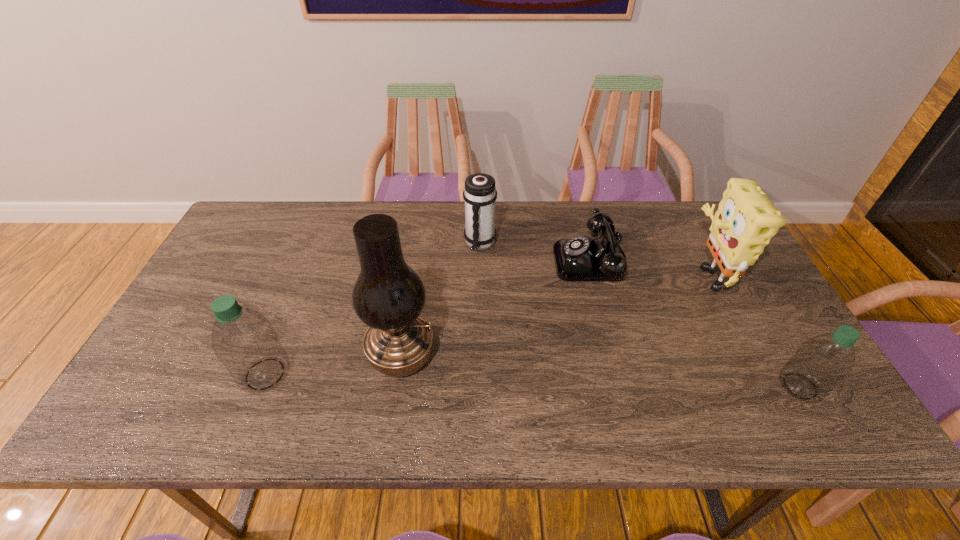
Find the location of a particular element. This screenshot has width=960, height=540. vacant region at the right edge is located at coordinates (725, 330).

Find the location of a particular element. The image size is (960, 540). vacant area at the far left corner is located at coordinates (252, 207).

In the image, there is a desktop. Where is `vacant area at the near left corner`? This screenshot has height=540, width=960. vacant area at the near left corner is located at coordinates (179, 382).

The image size is (960, 540). What are the coordinates of `free area in between the telephone and the thermos bottle` in the screenshot? It's located at (536, 252).

This screenshot has width=960, height=540. I want to click on free space between the third object from right to left and the fifth object from right to left, so click(496, 308).

Where is `free spot between the tallest object and the sponge`? This screenshot has width=960, height=540. free spot between the tallest object and the sponge is located at coordinates (553, 314).

Identify the location of free spot between the right water bottle and the telephone. This screenshot has width=960, height=540. (696, 323).

You are a GUI agent. You are given a task and a screenshot of the screen. Output one action in this format:
    pyautogui.click(x=<x>, y=<y>)
    Task: Click on the blank region between the thermos bottle and the shorter water bottle
    The width and height of the screenshot is (960, 540).
    Given the screenshot: What is the action you would take?
    pyautogui.click(x=640, y=315)

Identify the location of unoccupied position between the oil lamp and the thermos bottle. This screenshot has width=960, height=540. (441, 300).

Locate an element on the screen. This screenshot has height=540, width=960. vacant area that lies between the third object from left to right and the telephone is located at coordinates (536, 252).